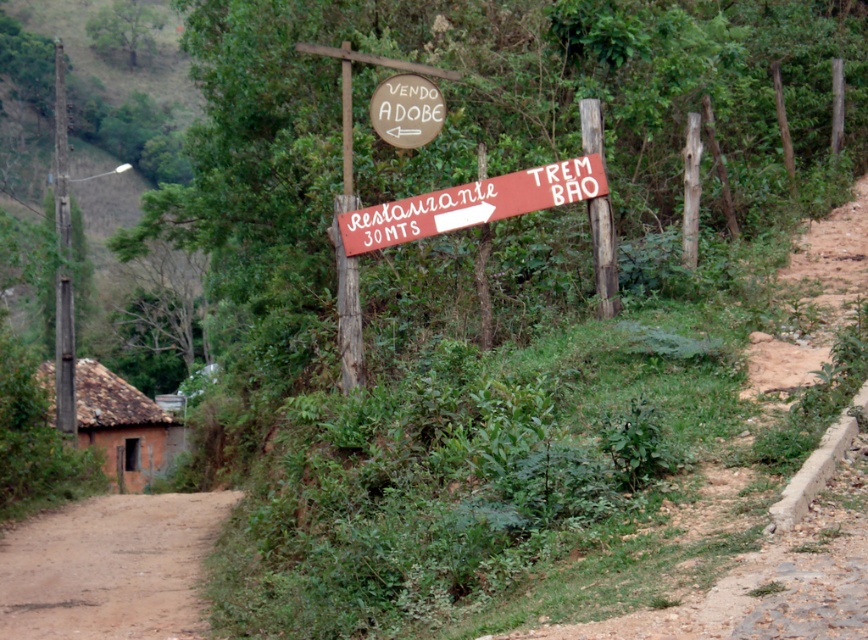
Can you confirm if wooden post at left is thinner than brown wooden sign at upper center?

In fact, wooden post at left might be wider than brown wooden sign at upper center.

Can you confirm if wooden post at left is bigger than brown wooden sign at upper center?

Correct, wooden post at left is larger in size than brown wooden sign at upper center.

This screenshot has width=868, height=640. Describe the element at coordinates (62, 262) in the screenshot. I see `wooden post at left` at that location.

Find the location of a particular element. wooden post at left is located at coordinates (62, 262).

Does red wooden sign at center have a larger size compared to wooden post at left?

No.

Does red wooden sign at center come behind wooden post at left?

No, it is in front of wooden post at left.

Does point (467, 205) come farther from viewer compared to point (56, 61)?

No.

Locate an element on the screen. This screenshot has height=640, width=868. red wooden sign at center is located at coordinates (471, 204).

Who is positioned more to the left, brown clay hut at lower left or brown wooden sign at upper center?

From the viewer's perspective, brown clay hut at lower left appears more on the left side.

Can you confirm if brown clay hut at lower left is positioned to the left of brown wooden sign at upper center?

Yes, brown clay hut at lower left is to the left of brown wooden sign at upper center.

Is point (135, 452) behind point (429, 136)?

Yes, it is behind point (429, 136).

You are a GUI agent. You are given a task and a screenshot of the screen. Output one action in this format:
    pyautogui.click(x=<x>, y=<y>)
    Task: Click on the brown clay hut at lower left
    The image size is (868, 640).
    Given the screenshot: What is the action you would take?
    pyautogui.click(x=123, y=426)